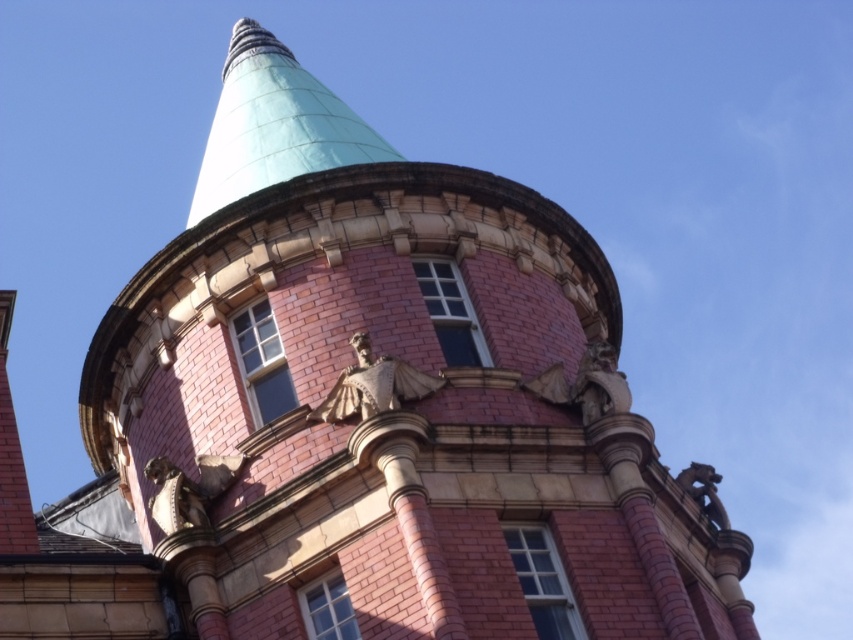
Does gold metallic statue at center appear over bronze/golden statue at lower right?

Correct, gold metallic statue at center is located above bronze/golden statue at lower right.

What are the coordinates of `gold metallic statue at center` in the screenshot? It's located at (373, 385).

Locate an element on the screen. Image resolution: width=853 pixels, height=640 pixels. polished bronze statue at upper center is located at coordinates (585, 385).

Which is above, polished bronze statue at upper center or bronze/golden statue at lower right?

Positioned higher is polished bronze statue at upper center.

What are the coordinates of `polished bronze statue at upper center` in the screenshot? It's located at (585, 385).

Can you confirm if gold metallic statue at center is positioned to the left of polished bronze statue at upper center?

Correct, you'll find gold metallic statue at center to the left of polished bronze statue at upper center.

Who is positioned more to the right, gold metallic statue at center or polished bronze statue at upper center?

polished bronze statue at upper center

Is point (428, 378) farther from camera compared to point (625, 397)?

That is False.

The width and height of the screenshot is (853, 640). In order to click on gold metallic statue at center in this screenshot , I will do `click(373, 385)`.